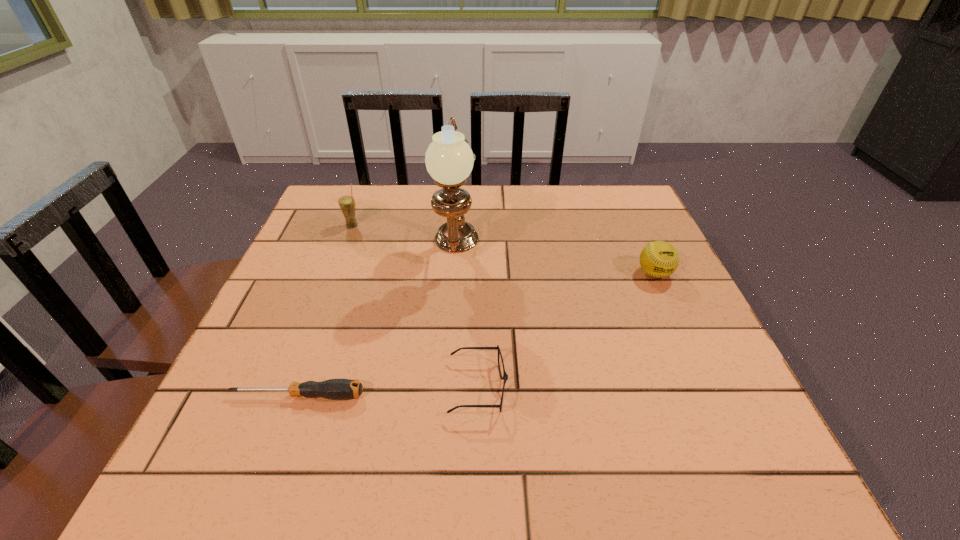
Locate an element on the screen. This screenshot has height=540, width=960. vacant space situated on the right of the shortest object is located at coordinates (426, 396).

At what (x,y) coordinates should I click in order to perform the action: click on oil lamp that is at the far edge. Please return your answer as a coordinate pair (x, y). Looking at the image, I should click on (449, 160).

What are the coordinates of `straw for drinking at the far edge` in the screenshot? It's located at (347, 204).

This screenshot has height=540, width=960. Identify the location of straw for drinking located at the left edge. (347, 204).

The image size is (960, 540). In order to click on screwdriver at the left edge in this screenshot , I will do `click(334, 389)`.

The height and width of the screenshot is (540, 960). Find the location of `object that is at the right edge`. object that is at the right edge is located at coordinates (659, 259).

Locate an element on the screen. This screenshot has height=540, width=960. object present at the far left corner is located at coordinates (347, 204).

This screenshot has width=960, height=540. Identify the location of vacant region at the far edge of the desktop. (389, 220).

The image size is (960, 540). In the image, there is a desktop. What are the coordinates of `vacant area at the near edge` in the screenshot? It's located at (669, 461).

At what (x,y) coordinates should I click in order to perform the action: click on free space at the left edge. Please return your answer as a coordinate pair (x, y). Looking at the image, I should click on (331, 331).